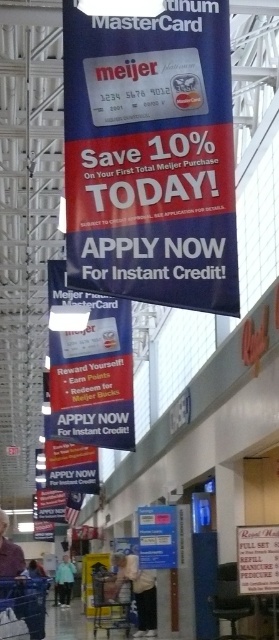
You are a customer standing in the mall and see the metallic blue shopping cart at lower left and the light blue denim jacket at lower left. Which object is closer to the floor?

The metallic blue shopping cart at lower left is closer to the floor because it is below the light blue denim jacket at lower left.